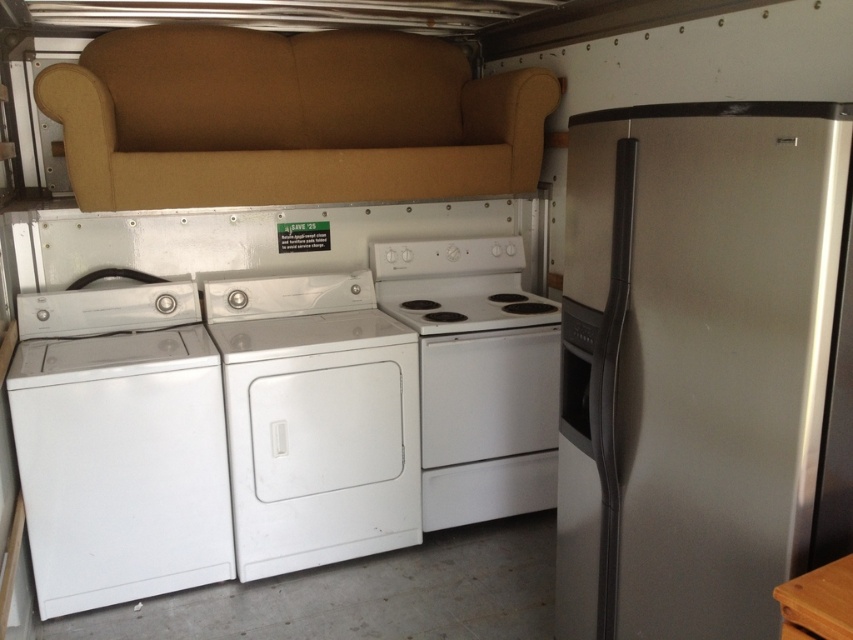
Question: Does satin silver refrigerator at right have a larger size compared to white glossy dishwasher at lower left?

Choices:
 (A) yes
 (B) no

Answer: (A)

Question: Which of the following is the closest to the observer?

Choices:
 (A) white matte/texture dryer at center
 (B) white glossy electric stove at center

Answer: (A)

Question: Which of the following is the closest to the observer?

Choices:
 (A) (415, 412)
 (B) (675, 592)
 (C) (73, 513)
 (D) (456, 454)

Answer: (B)

Question: Is white glossy dishwasher at lower left to the right of white glossy electric stove at center from the viewer's perspective?

Choices:
 (A) no
 (B) yes

Answer: (A)

Question: Which object is positioned closest to the beige fabric couch at upper left?

Choices:
 (A) satin silver refrigerator at right
 (B) white glossy washer at center
 (C) white matte/texture dryer at center

Answer: (B)

Question: Does beige fabric couch at upper left lie in front of white glossy washer at center?

Choices:
 (A) yes
 (B) no

Answer: (A)